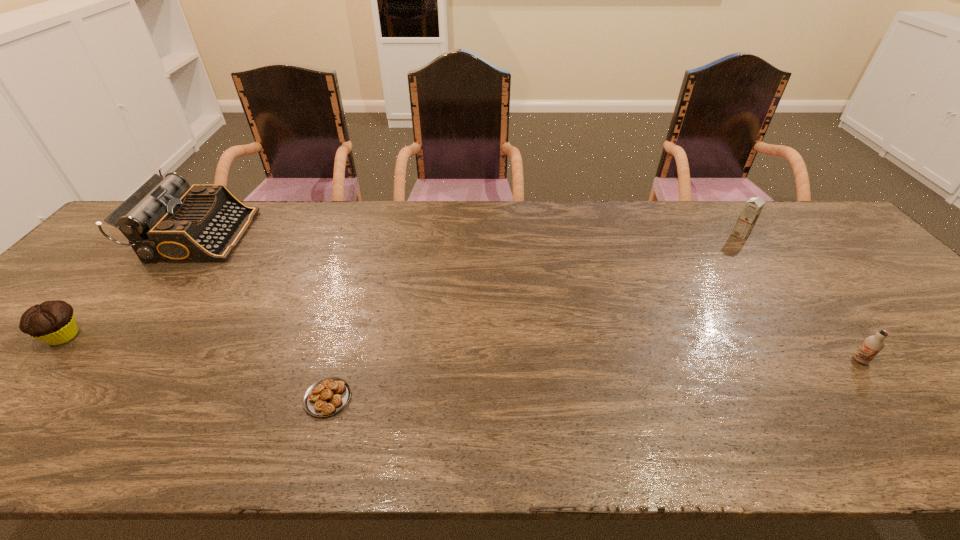
You are a GUI agent. You are given a task and a screenshot of the screen. Output one action in this format:
    pyautogui.click(x=<x>, y=<y>)
    Task: Click on the typewriter
    This screenshot has height=540, width=960.
    Given the screenshot: What is the action you would take?
    pyautogui.click(x=165, y=220)

I want to click on the farther chocolate milk, so click(x=753, y=207).

I want to click on the taller chocolate milk, so click(x=753, y=207).

Image resolution: width=960 pixels, height=540 pixels. In order to click on the nearer chocolate milk in this screenshot , I will do `click(872, 345)`.

Where is `the right chocolate milk`? Image resolution: width=960 pixels, height=540 pixels. the right chocolate milk is located at coordinates (872, 345).

The image size is (960, 540). Find the location of `muffin`. muffin is located at coordinates (53, 322).

The image size is (960, 540). What are the coordinates of `the nearest object` in the screenshot? It's located at (327, 396).

Image resolution: width=960 pixels, height=540 pixels. I want to click on the third object from right to left, so click(x=327, y=396).

Find the location of `vacant space located 0.050m on the keyboard of the tallest object`. vacant space located 0.050m on the keyboard of the tallest object is located at coordinates (261, 235).

You are a GUI agent. You are given a task and a screenshot of the screen. Output one action in this format:
    pyautogui.click(x=<x>, y=<y>)
    Task: Click on the vacant point located on the left of the fourth shortest object
    
    Given the screenshot: What is the action you would take?
    pyautogui.click(x=686, y=234)